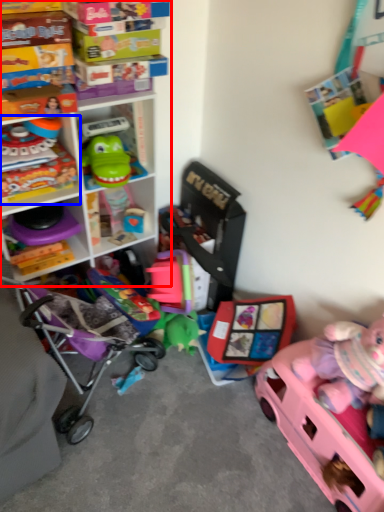
Question: Which object appears farthest to the camera in this image, shelf (highlighted by a red box) or toy (highlighted by a blue box)?

Choices:
 (A) shelf
 (B) toy

Answer: (B)